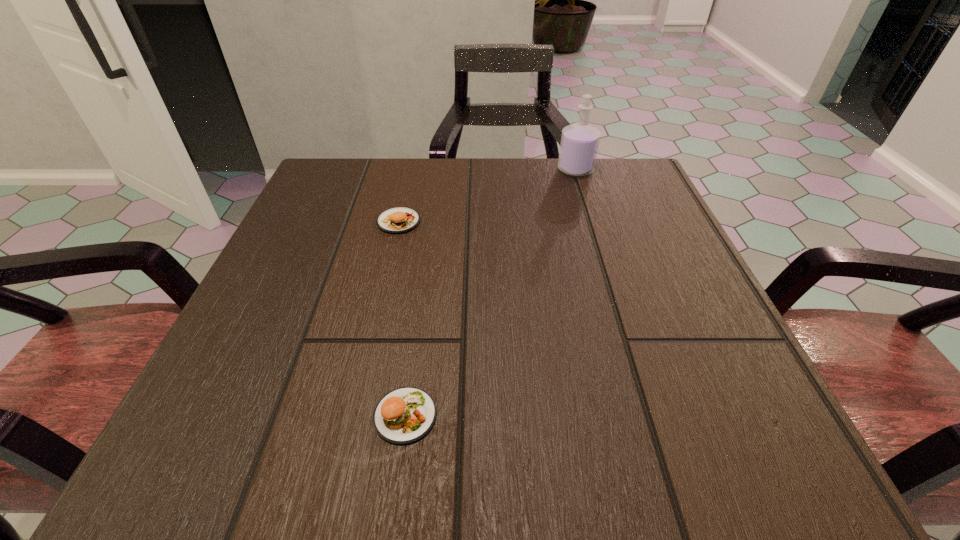
At what (x,y) coordinates should I click in order to perform the action: click on perfume. Please return your answer as a coordinate pair (x, y). The height and width of the screenshot is (540, 960). Looking at the image, I should click on (579, 145).

In order to click on the tallest object in this screenshot , I will do `click(579, 145)`.

Find the location of a particular element. The image size is (960, 540). the second nearest object is located at coordinates (397, 220).

At what (x,y) coordinates should I click in order to perform the action: click on the second shortest object. Please return your answer as a coordinate pair (x, y). Image resolution: width=960 pixels, height=540 pixels. Looking at the image, I should click on (397, 220).

At what (x,y) coordinates should I click in order to perform the action: click on the shorter patty. Please return your answer as a coordinate pair (x, y). Looking at the image, I should click on (404, 415).

The height and width of the screenshot is (540, 960). I want to click on the nearest object, so click(404, 415).

You are a GUI agent. You are given a task and a screenshot of the screen. Output one action in this format:
    pyautogui.click(x=<x>, y=<y>)
    Task: Click on the free space located 0.350m on the left of the farthest object
    The image size is (960, 540).
    Given the screenshot: What is the action you would take?
    pyautogui.click(x=406, y=170)

This screenshot has width=960, height=540. In order to click on vacant region located on the right of the second tallest object in this screenshot , I will do `click(603, 221)`.

The height and width of the screenshot is (540, 960). What are the coordinates of `free region located on the left of the shorter patty` in the screenshot? It's located at (312, 415).

The image size is (960, 540). Find the location of `perfume at the far edge`. perfume at the far edge is located at coordinates click(579, 145).